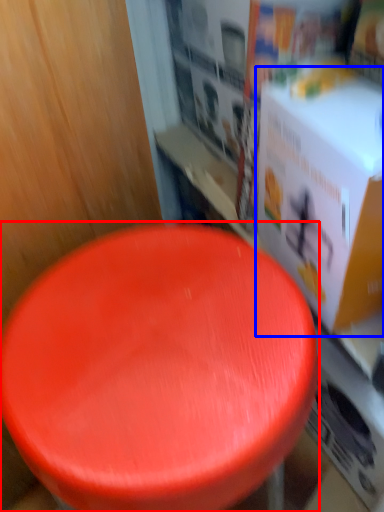
Question: Among these objects, which one is nearest to the camera, stool (highlighted by a red box) or box (highlighted by a blue box)?

Choices:
 (A) stool
 (B) box

Answer: (A)